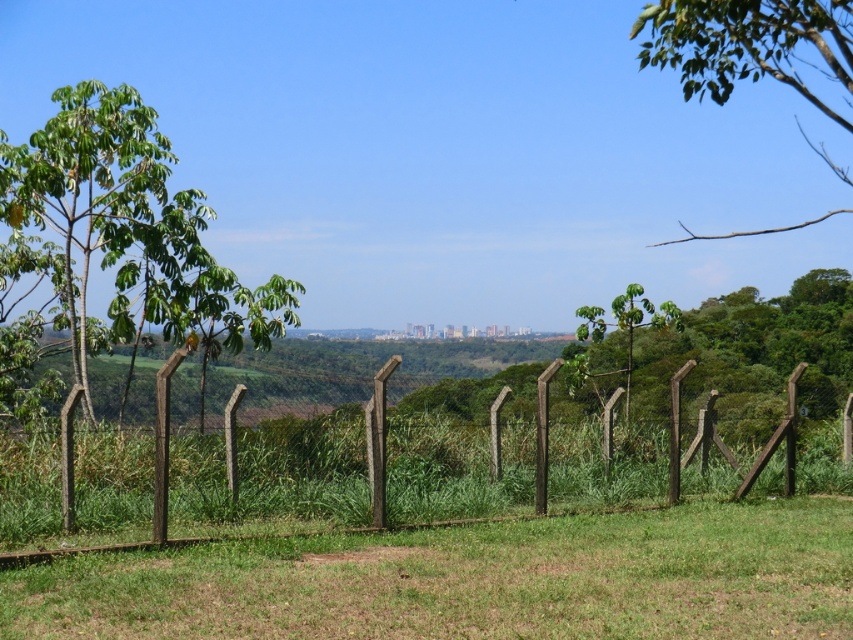
Does green leafy tree at left come behind green leafy branch at upper right?

That is True.

Does green leafy tree at left lie in front of green leafy branch at upper right?

No, green leafy tree at left is behind green leafy branch at upper right.

Which is in front, point (268, 339) or point (840, 64)?

Point (840, 64) is in front.

The image size is (853, 640). What are the coordinates of `green leafy tree at left` in the screenshot? It's located at (129, 228).

Does brown wooden fence at center come behind green leafy tree at left?

No.

Between brown wooden fence at center and green leafy tree at left, which one is positioned higher?

Positioned higher is green leafy tree at left.

Which is behind, point (465, 448) or point (163, 301)?

The point (465, 448) is behind.

Where is `brown wooden fence at center`? The height and width of the screenshot is (640, 853). brown wooden fence at center is located at coordinates (274, 474).

Between point (418, 435) and point (782, 230), which one is positioned in front?

Point (418, 435) is more forward.

Is point (554, 484) positioned in front of point (773, 36)?

That is False.

The image size is (853, 640). What are the coordinates of `brown wooden fence at center` in the screenshot? It's located at (274, 474).